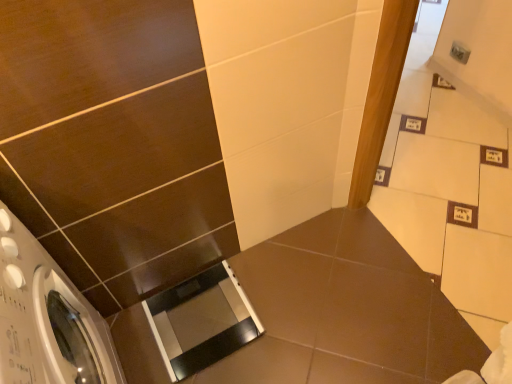
This screenshot has width=512, height=384. What do you see at coordinates (345, 311) in the screenshot?
I see `black glossy scale at lower center` at bounding box center [345, 311].

Locate an element on the screen. This screenshot has height=384, width=512. black glossy scale at lower center is located at coordinates (345, 311).

This screenshot has height=384, width=512. What do you see at coordinates (201, 321) in the screenshot?
I see `transparent plastic screen door at lower center` at bounding box center [201, 321].

You are a GUI agent. You are given a task and a screenshot of the screen. Output one action in this format:
    pyautogui.click(x=<x>, y=<y>)
    Task: Click on the black glossy scale at lower center
    The image size is (512, 384).
    Given the screenshot: What is the action you would take?
    [x=345, y=311]

Consider the image. Is transparent plastic screen door at lower center positioned with its back to white glossy washing machine at lower left?

No, transparent plastic screen door at lower center is not facing the opposite direction of white glossy washing machine at lower left.

Which is behind, transparent plastic screen door at lower center or white glossy washing machine at lower left?

transparent plastic screen door at lower center is behind.

From a real-world perspective, which is physically below, transparent plastic screen door at lower center or white glossy washing machine at lower left?

transparent plastic screen door at lower center is physically lower.

Who is shorter, transparent plastic screen door at lower center or white glossy washing machine at lower left?

transparent plastic screen door at lower center is shorter.

From the picture: Is white glossy washing machine at lower left positioned far away from transparent plastic screen door at lower center?

That's not correct — white glossy washing machine at lower left is a little close to transparent plastic screen door at lower center.

Is transparent plastic screen door at lower center at the back of white glossy washing machine at lower left?

No, white glossy washing machine at lower left's orientation is not away from transparent plastic screen door at lower center.

Is white glossy washing machine at lower left inside or outside of transparent plastic screen door at lower center?

white glossy washing machine at lower left lies outside transparent plastic screen door at lower center.

In the image, there is a white glossy washing machine at lower left. Where is `counter top below it (from a real-world perspective)`? counter top below it (from a real-world perspective) is located at coordinates (345, 311).

Who is bigger, black glossy scale at lower center or white glossy washing machine at lower left?

With larger size is white glossy washing machine at lower left.

From a real-world perspective, relative to white glossy washing machine at lower left, is black glossy scale at lower center vertically above or below?

In terms of real-world spatial position, black glossy scale at lower center is below white glossy washing machine at lower left.

From the image's perspective, does black glossy scale at lower center appear lower than white glossy washing machine at lower left?

Yes, from the image's perspective, black glossy scale at lower center is beneath white glossy washing machine at lower left.

Could black glossy scale at lower center be considered to be inside transparent plastic screen door at lower center?

Definitely not — black glossy scale at lower center is not inside transparent plastic screen door at lower center.

Image resolution: width=512 pixels, height=384 pixels. Find the location of `screen door that appears on the left of black glossy scale at lower center`. screen door that appears on the left of black glossy scale at lower center is located at coordinates (201, 321).

From the image's perspective, between transparent plastic screen door at lower center and black glossy scale at lower center, which one is located above?

transparent plastic screen door at lower center appears higher in the image.

From a real-world perspective, is black glossy scale at lower center physically above transparent plastic screen door at lower center?

Incorrect, from a real-world perspective, black glossy scale at lower center is lower than transparent plastic screen door at lower center.

Which is less distant, (x=311, y=277) or (x=222, y=261)?

Point (x=311, y=277)

Can you confirm if black glossy scale at lower center is wider than transparent plastic screen door at lower center?

Yes.

Is black glossy scale at lower center far away from transparent plastic screen door at lower center?

black glossy scale at lower center is actually quite close to transparent plastic screen door at lower center.

Considering the relative sizes of white glossy washing machine at lower left and black glossy scale at lower center in the image provided, is white glossy washing machine at lower left thinner than black glossy scale at lower center?

Yes, white glossy washing machine at lower left is thinner than black glossy scale at lower center.

Is white glossy washing machine at lower left oriented towards black glossy scale at lower center?

Yes, white glossy washing machine at lower left faces towards black glossy scale at lower center.

Is point (51, 335) closer to viewer compared to point (145, 323)?

That is True.

The height and width of the screenshot is (384, 512). I want to click on counter top that is behind the white glossy washing machine at lower left, so click(345, 311).

The height and width of the screenshot is (384, 512). I want to click on screen door behind the white glossy washing machine at lower left, so click(x=201, y=321).

Locate an element on the screen. Image resolution: width=512 pixels, height=384 pixels. screen door that appears on the right of white glossy washing machine at lower left is located at coordinates (201, 321).

When comparing their distances from black glossy scale at lower center, does white glossy washing machine at lower left or transparent plastic screen door at lower center seem further?

Among the two, white glossy washing machine at lower left is located further to black glossy scale at lower center.

Which object lies nearer to the anchor point black glossy scale at lower center, transparent plastic screen door at lower center or white glossy washing machine at lower left?

Based on the image, transparent plastic screen door at lower center appears to be nearer to black glossy scale at lower center.

Considering their positions, is white glossy washing machine at lower left positioned closer to transparent plastic screen door at lower center than black glossy scale at lower center?

Based on the image, black glossy scale at lower center appears to be nearer to transparent plastic screen door at lower center.

Estimate the real-world distances between objects in this image. Which object is closer to white glossy washing machine at lower left, transparent plastic screen door at lower center or black glossy scale at lower center?

Among the two, transparent plastic screen door at lower center is located nearer to white glossy washing machine at lower left.

Which object lies further to the anchor point white glossy washing machine at lower left, black glossy scale at lower center or transparent plastic screen door at lower center?

black glossy scale at lower center lies further to white glossy washing machine at lower left than the other object.

Based on their spatial positions, is black glossy scale at lower center or white glossy washing machine at lower left closer to transparent plastic screen door at lower center?

black glossy scale at lower center is closer to transparent plastic screen door at lower center.

You are a GUI agent. You are given a task and a screenshot of the screen. Output one action in this format:
    pyautogui.click(x=<x>, y=<y>)
    Task: Click on the counter top between white glossy washing machine at lower left and transparent plastic screen door at lower center from front to back
    The width and height of the screenshot is (512, 384).
    Given the screenshot: What is the action you would take?
    pyautogui.click(x=345, y=311)